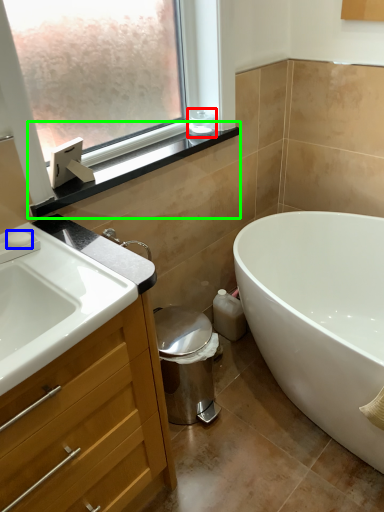
Question: Which object is the farthest from toiletry (highlighted by a red box)? Choose among these: soap (highlighted by a blue box) or window sill (highlighted by a green box).

Choices:
 (A) soap
 (B) window sill

Answer: (A)